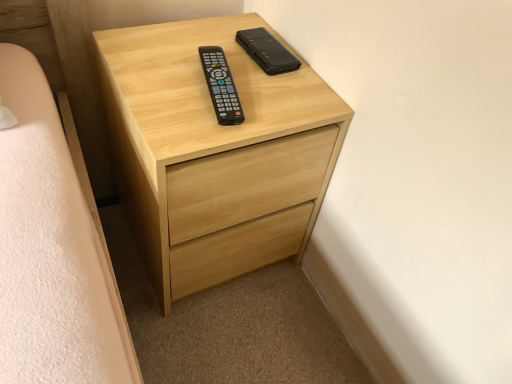
The width and height of the screenshot is (512, 384). Find the location of `free space that is to the left of black leather phone case at upper center, positioned as the first control in back-to-front order`. free space that is to the left of black leather phone case at upper center, positioned as the first control in back-to-front order is located at coordinates (192, 51).